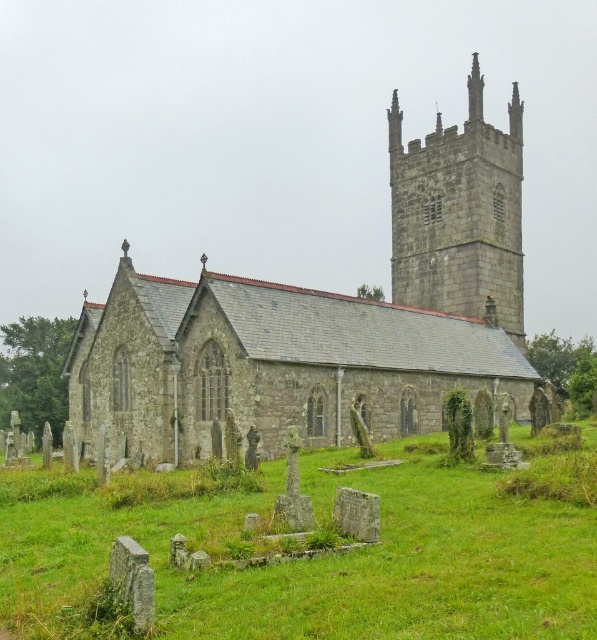
Can you confirm if stone church at center is smaller than stone steeple at upper center?

No, stone church at center is not smaller than stone steeple at upper center.

Does stone church at center appear under stone steeple at upper center?

Yes.

Measure the distance between stone church at center and camera.

A distance of 207.17 feet exists between stone church at center and camera.

Locate an element on the screen. The image size is (597, 640). stone church at center is located at coordinates (327, 320).

Does green grass at center have a lesser height compared to stone steeple at upper center?

Indeed, green grass at center has a lesser height compared to stone steeple at upper center.

Is green grass at center taller than stone steeple at upper center?

No.

Is point (44, 516) in front of point (479, 253)?

That is True.

In order to click on green grass at center in this screenshot , I will do `click(312, 560)`.

Which of these two, stone church at center or green grass at center, stands shorter?

green grass at center

Is stone church at center behind green grass at center?

Yes, stone church at center is behind green grass at center.

I want to click on stone church at center, so (x=327, y=320).